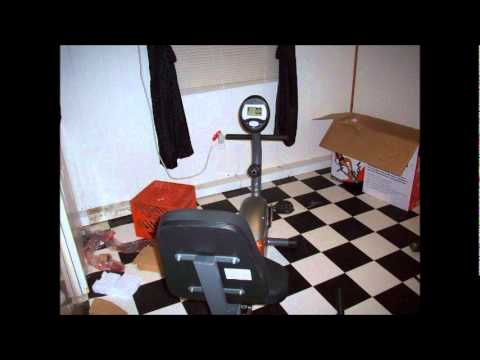
You are a GUI agent. You are given a task and a screenshot of the screen. Output one action in this format:
    pyautogui.click(x=<x>, y=<y>)
    Task: Click on the drapes
    The height and width of the screenshot is (360, 480).
    Given the screenshot: What is the action you would take?
    pyautogui.click(x=164, y=94), pyautogui.click(x=287, y=86)